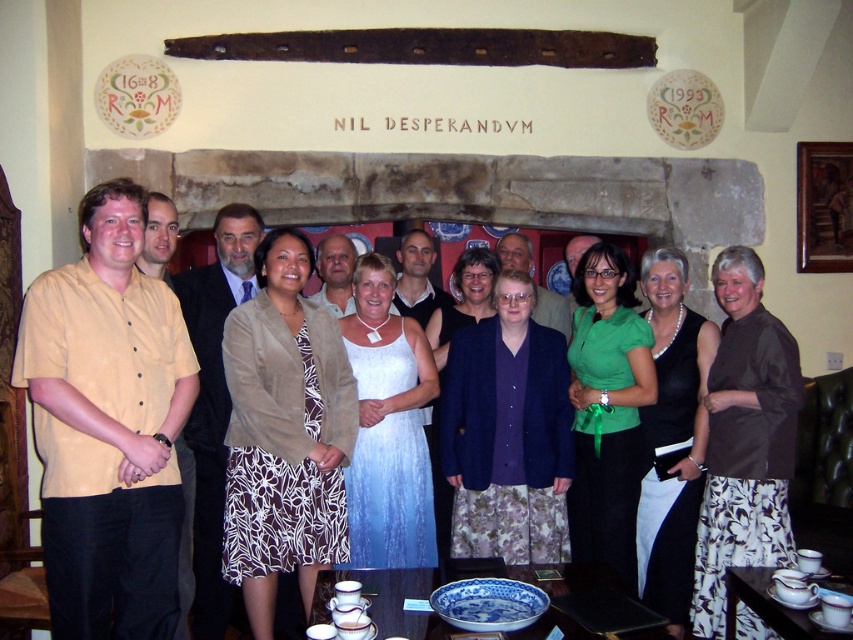
Can you confirm if beige suede blazer at center is wider than purple cotton blazer at center?

No, beige suede blazer at center is not wider than purple cotton blazer at center.

Is beige suede blazer at center closer to camera compared to purple cotton blazer at center?

That is True.

What do you see at coordinates (283, 433) in the screenshot? The height and width of the screenshot is (640, 853). I see `beige suede blazer at center` at bounding box center [283, 433].

Locate an element on the screen. The image size is (853, 640). beige suede blazer at center is located at coordinates (283, 433).

Does matte yellow shirt at center have a larger size compared to white satin dress at center?

Yes, matte yellow shirt at center is bigger than white satin dress at center.

Is matte yellow shirt at center shorter than white satin dress at center?

No.

The image size is (853, 640). Identify the location of matte yellow shirt at center. pos(108,426).

In order to click on matte yellow shirt at center in this screenshot , I will do `click(108, 426)`.

At what (x,y) coordinates should I click in order to perform the action: click on purple cotton blazer at center. Please return your answer as a coordinate pair (x, y). This screenshot has height=640, width=853. Looking at the image, I should click on (508, 433).

What do you see at coordinates (508, 433) in the screenshot? I see `purple cotton blazer at center` at bounding box center [508, 433].

Does point (477, 545) come behind point (786, 442)?

Yes, it is.

This screenshot has height=640, width=853. Find the location of `purple cotton blazer at center`. purple cotton blazer at center is located at coordinates (508, 433).